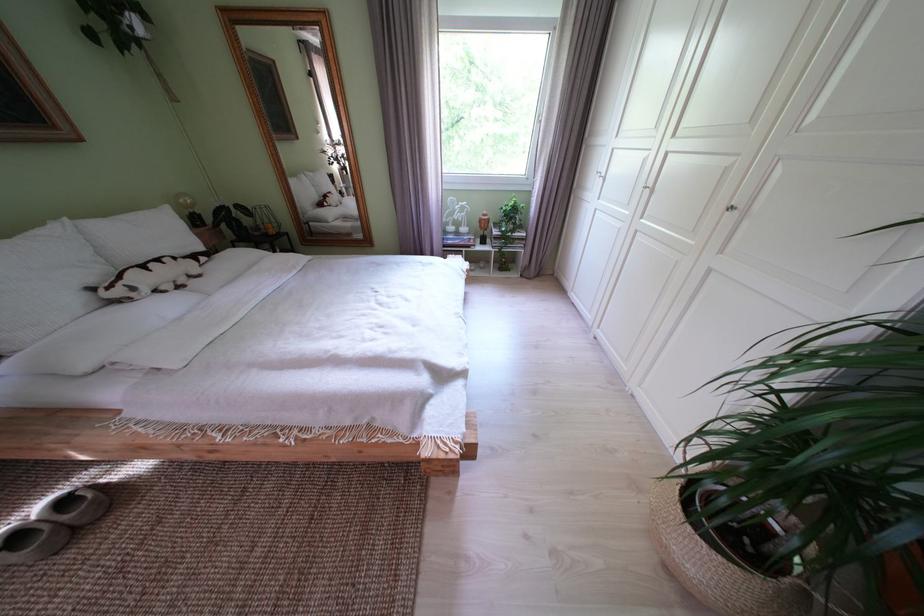
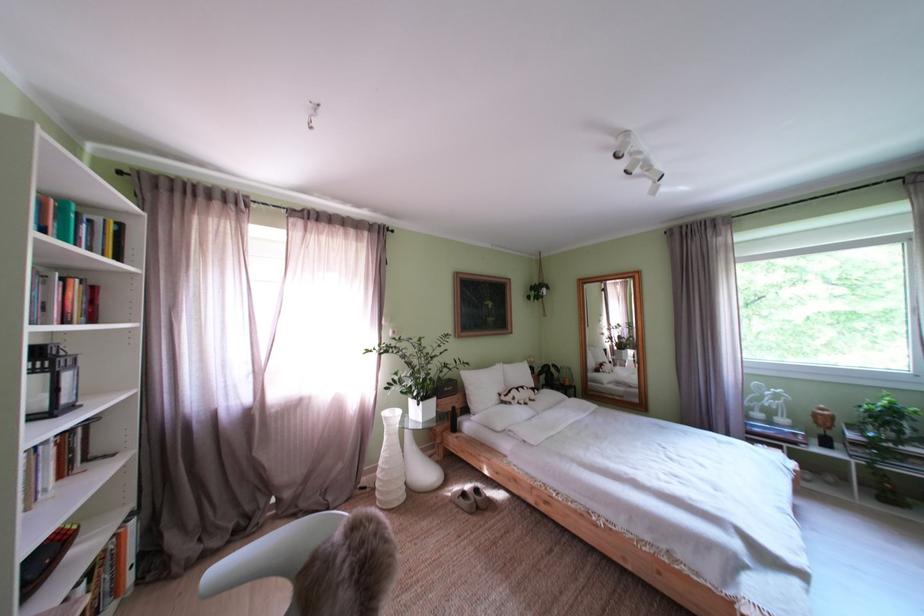
Locate, in the second image, the point that corresponds to (x=146, y=294) in the first image.

(525, 405)